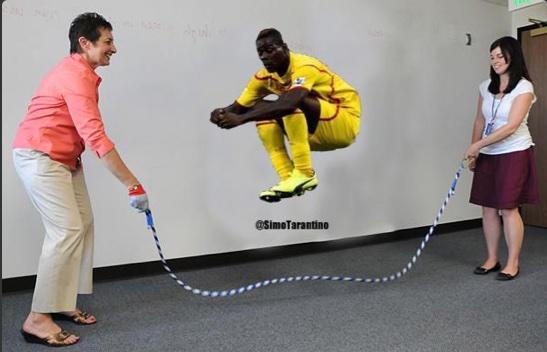
This screenshot has width=547, height=352. Identify the location of carpet. (395, 326).